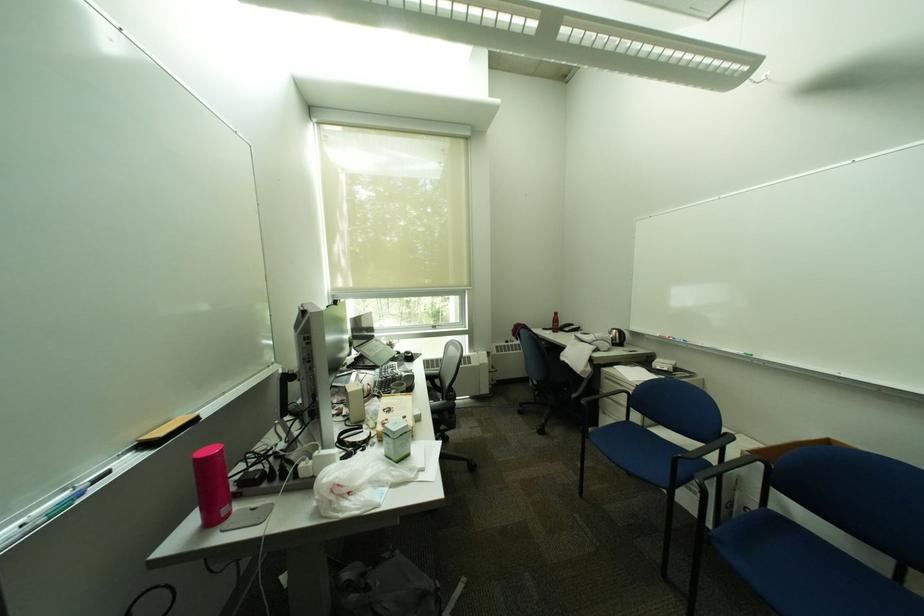
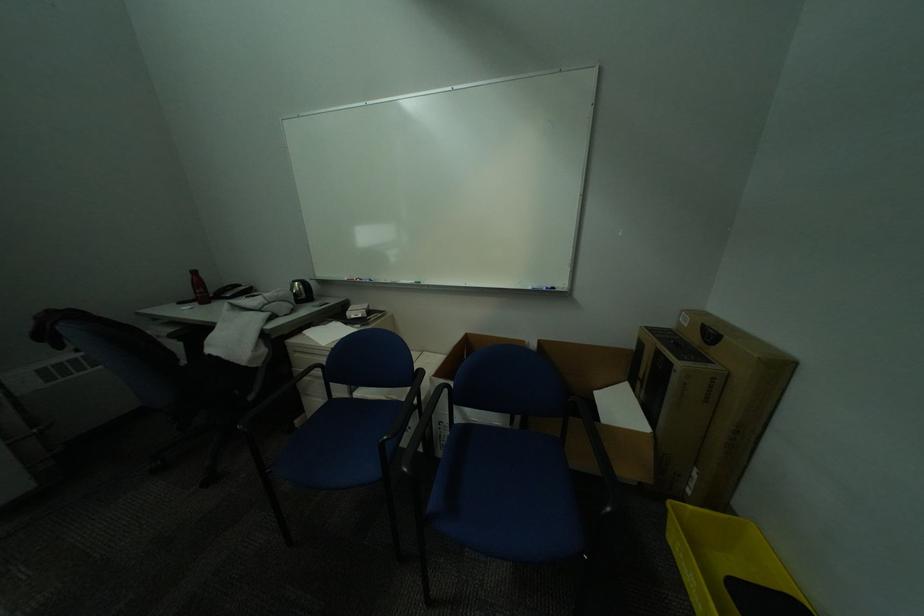
Question: The camera is either moving clockwise (left) or counter-clockwise (right) around the object. The first image is from the beginning of the video and the second image is from the end. Is the camera moving left or right when shooting the video?

Choices:
 (A) Left
 (B) Right

Answer: (A)